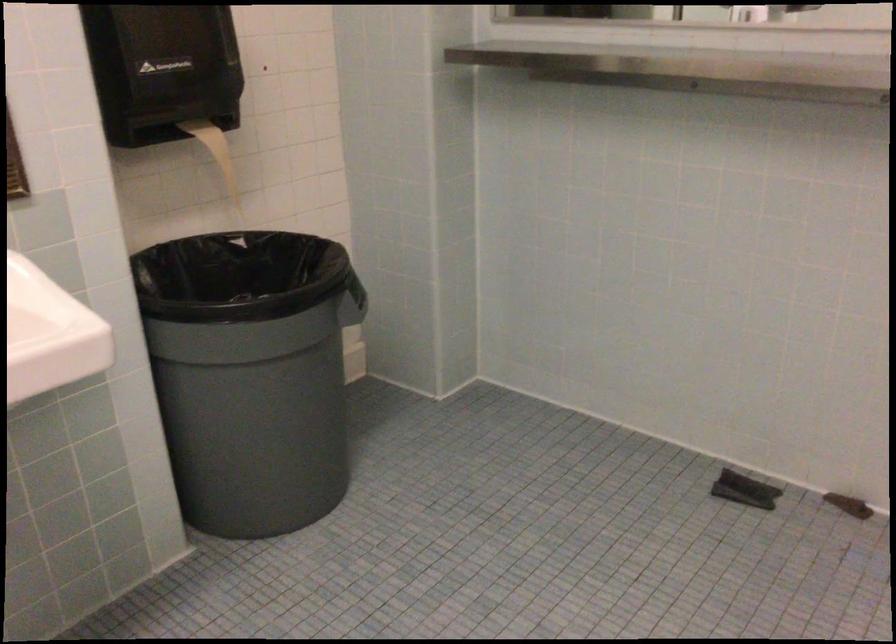
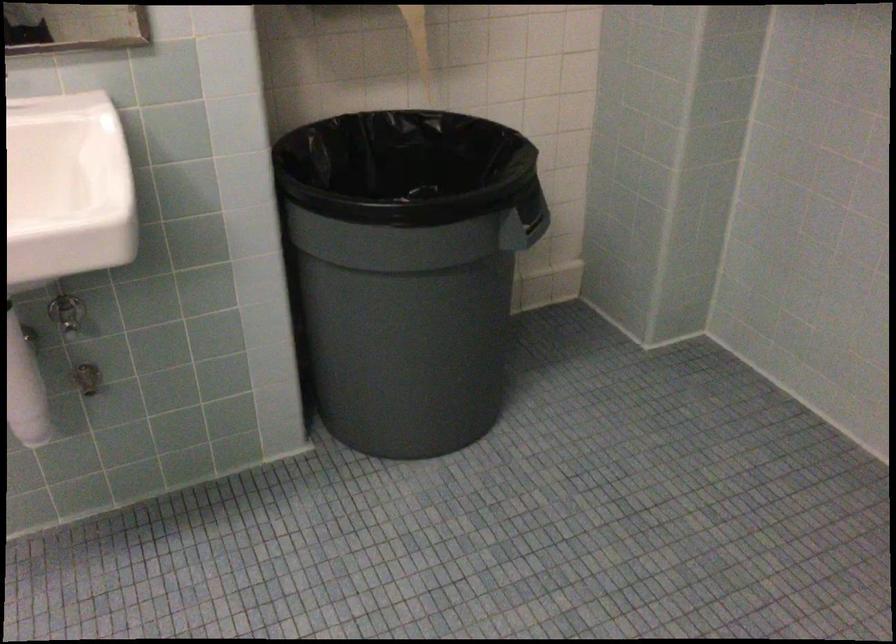
In the second image, find the point that corresponds to pixel 257 482 in the first image.

(382, 395)